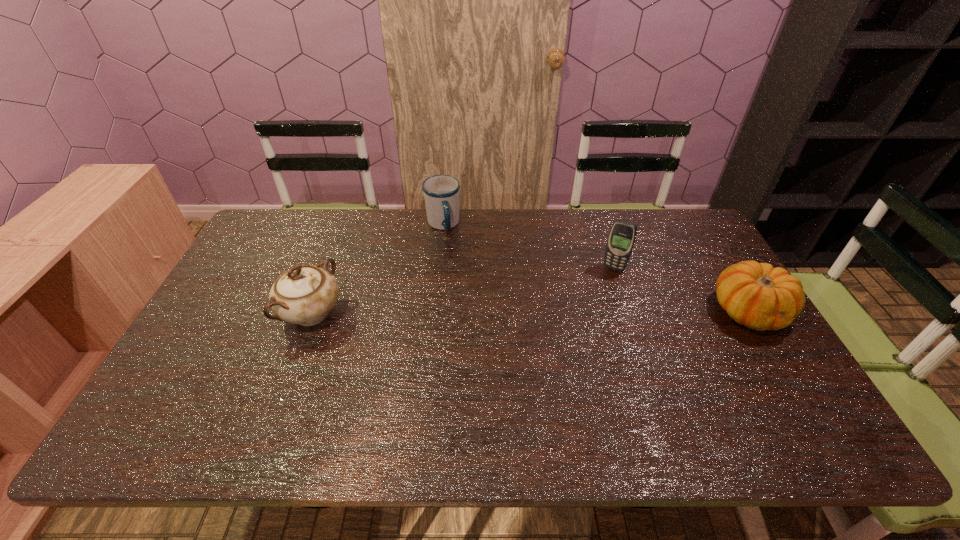
Identify which object is the second closest to the farthest object. Please provide its 2D coordinates. Your answer should be formatted as a tuple, i.e. [(x, y)], where the tuple contains the x and y coordinates of a point satisfying the conditions above.

[(622, 236)]

Where is `object that can be found as the third closest to the gourd`? object that can be found as the third closest to the gourd is located at coordinates (305, 295).